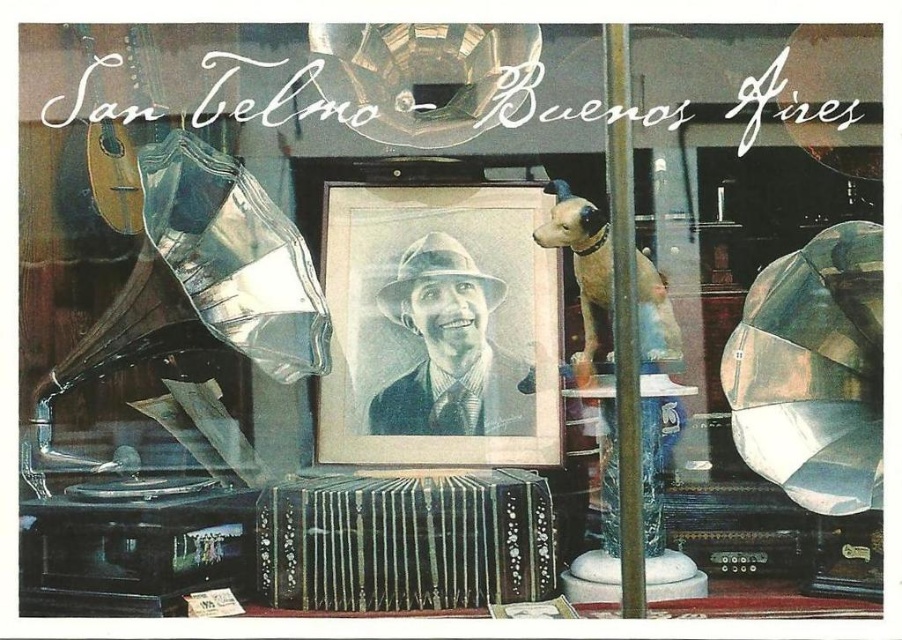
Question: Is black polished wood accordion at center below black paper portrait at center?

Choices:
 (A) yes
 (B) no

Answer: (A)

Question: Observing the image, what is the correct spatial positioning of black polished wood accordion at center in reference to black paper portrait at center?

Choices:
 (A) above
 (B) below

Answer: (B)

Question: From the image, what is the correct spatial relationship of black polished wood accordion at center in relation to black paper portrait at center?

Choices:
 (A) above
 (B) below

Answer: (B)

Question: Which of the following is the farthest from the observer?

Choices:
 (A) black paper portrait at center
 (B) black polished wood accordion at center

Answer: (A)

Question: Among these points, which one is nearest to the camera?

Choices:
 (A) (505, 548)
 (B) (443, 285)

Answer: (A)